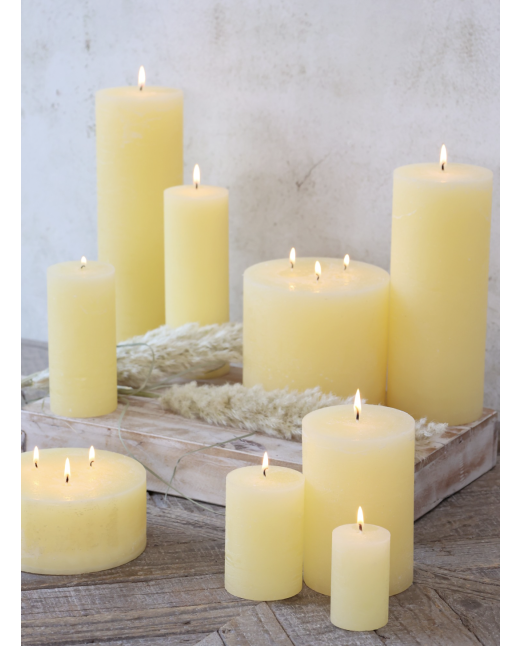
Identify the location of candles. This screenshot has width=520, height=646. (146, 136), (213, 211), (85, 307), (328, 317), (447, 229), (383, 422), (368, 548), (249, 494), (85, 501).